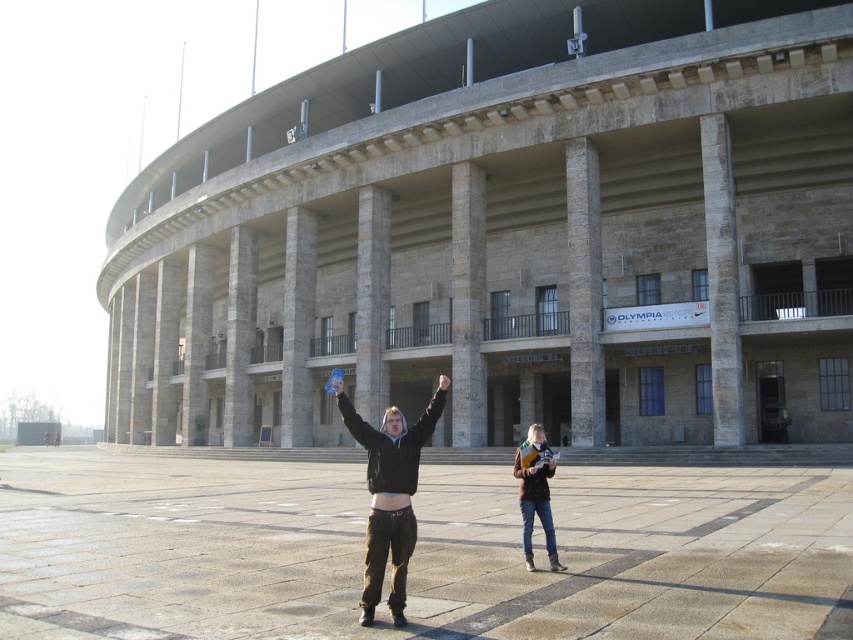
The image size is (853, 640). Find the location of `dark brown hoodie at center`. dark brown hoodie at center is located at coordinates (389, 497).

Does dark brown hoodie at center have a smaller size compared to brown leather jacket at center?

Yes.

Image resolution: width=853 pixels, height=640 pixels. I want to click on dark brown hoodie at center, so click(389, 497).

Is point (531, 461) more distant than point (438, 424)?

No, it is in front of (438, 424).

Which is in front, point (524, 508) or point (431, 440)?

Point (524, 508)

Locate an element on the screen. brown leather jacket at center is located at coordinates (535, 492).

Does point (387, 426) come closer to viewer compared to point (440, 376)?

Yes.

The width and height of the screenshot is (853, 640). What do you see at coordinates (389, 497) in the screenshot?
I see `dark brown hoodie at center` at bounding box center [389, 497].

In order to click on dark brown hoodie at center in this screenshot , I will do `click(389, 497)`.